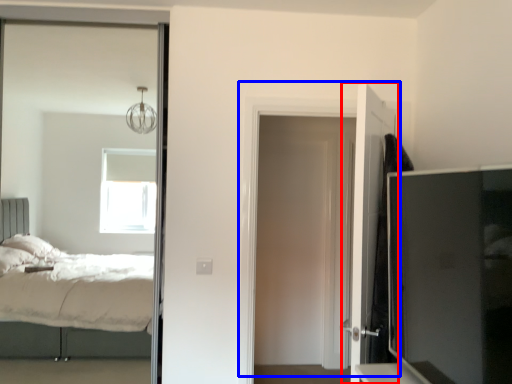
Question: Which of the following is the closest to the observer, door (highlighted by a red box) or door (highlighted by a blue box)?

Choices:
 (A) door
 (B) door

Answer: (A)